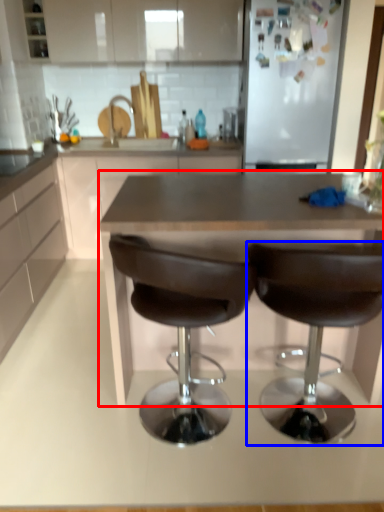
Question: Among these objects, which one is farthest to the camera, table (highlighted by a red box) or chair (highlighted by a blue box)?

Choices:
 (A) table
 (B) chair

Answer: (A)